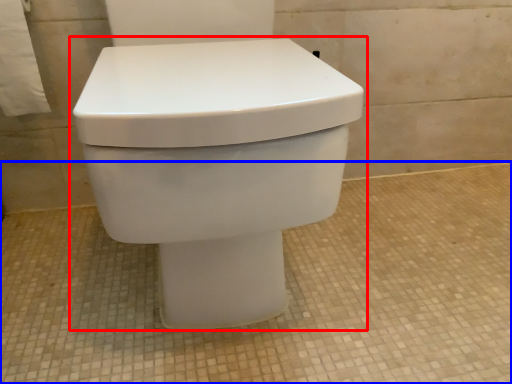
Question: Which of the following is the closest to the observer, toilet (highlighted by a red box) or concrete (highlighted by a blue box)?

Choices:
 (A) toilet
 (B) concrete

Answer: (A)